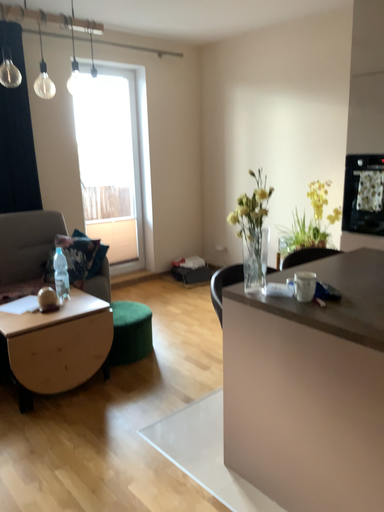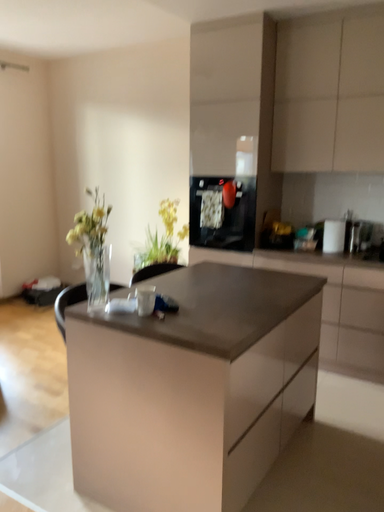
Question: Which way did the camera rotate in the video?

Choices:
 (A) rotated left
 (B) rotated right

Answer: (B)